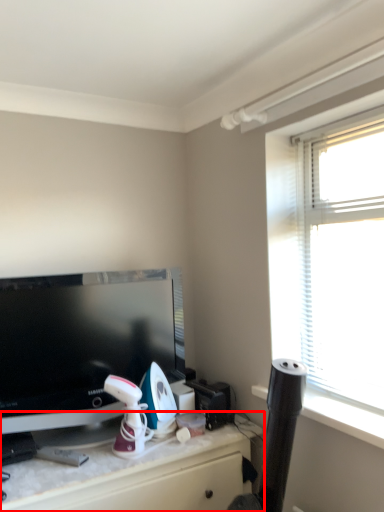
Question: From the image's perspective, what is the correct spatial positioning of desk (annotated by the red box) in reference to television?

Choices:
 (A) above
 (B) below

Answer: (B)